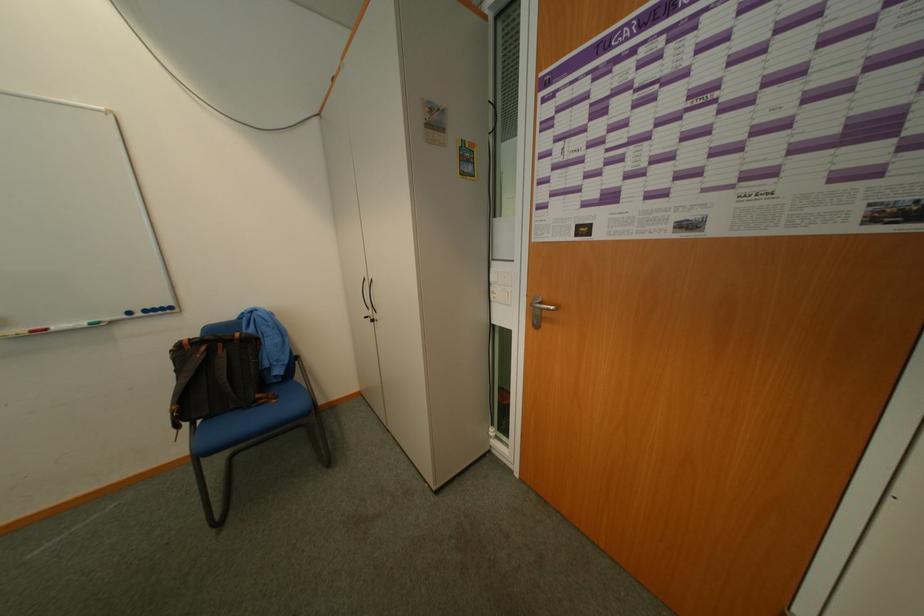
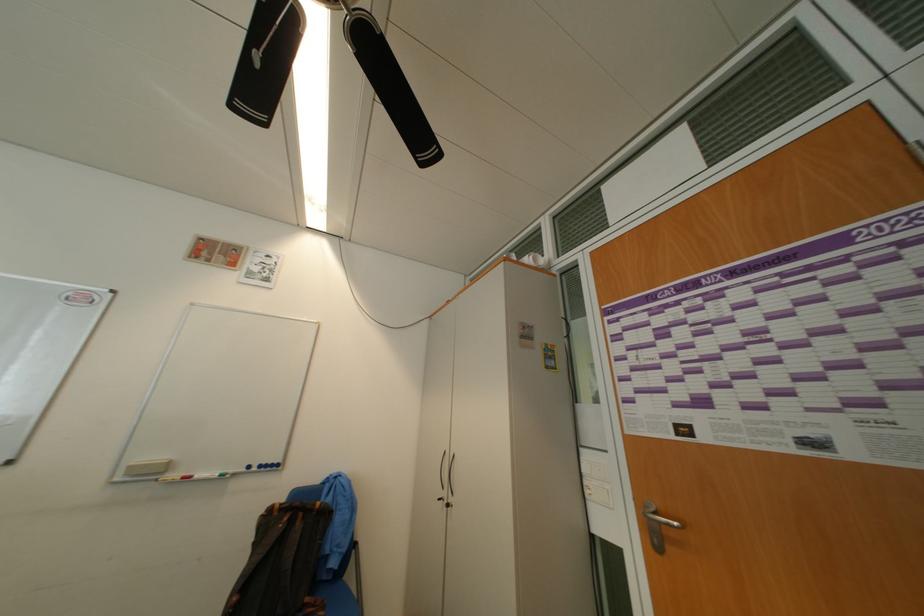
In the second image, find the point that corresponds to point 375,318 in the first image.

(448, 501)